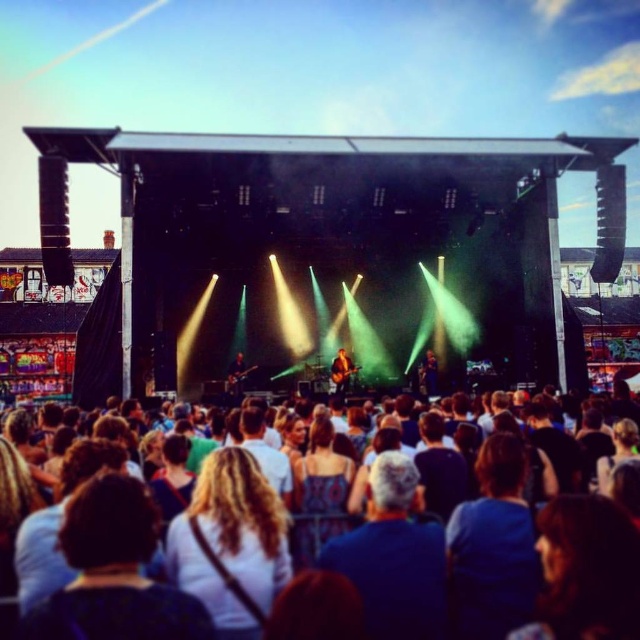
You are standing at the back of the crowd and want to take a photo of the stage. There are two points on the stage that you want to capture in your photo. The first point is at coordinate point (428, 381) and the second is at point (346, 385). Which point will appear closer to the bottom edge of your camera view?

The point at (428, 381) will appear closer to the bottom edge of your camera view because it is closer to the camera than point (346, 385).

In the scene shown: You are a photographer standing at the edge of the stage. You want to take a photo of the dark brown leather jacket at center without the brown fabric crowd at lower center blocking it. Is it possible?

The brown fabric crowd at lower center is taller than the dark brown leather jacket at center, so the crowd would block the jacket in the photo.